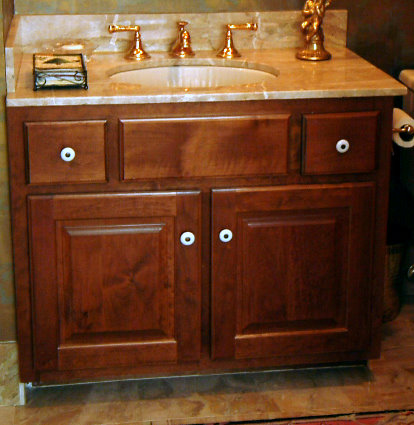
The width and height of the screenshot is (414, 425). What are the coordinates of `drawers` in the screenshot? It's located at (69, 131), (362, 146).